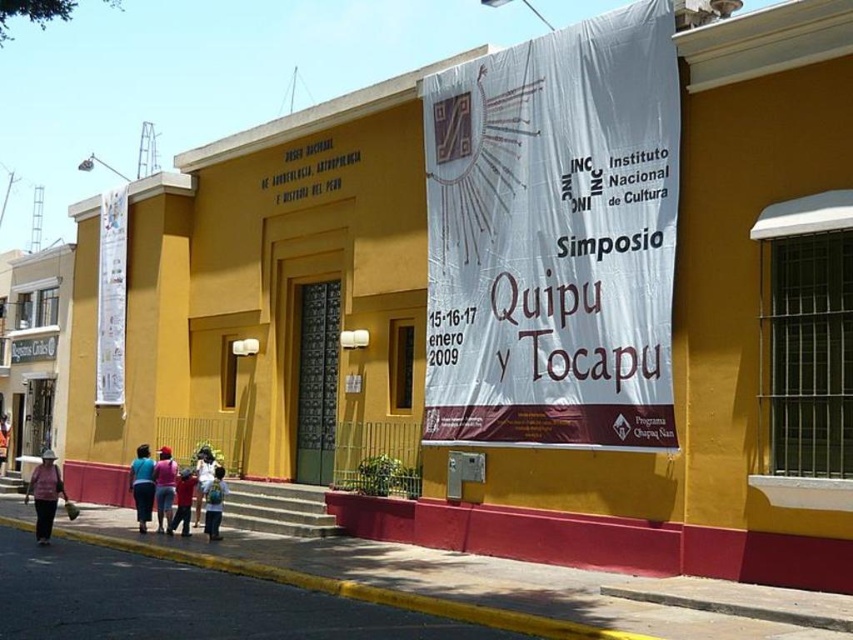
From the picture: Which is below, blue fabric shirt at lower left or blue denim jeans at lower center?

blue fabric shirt at lower left

Who is more distant from viewer, (x=144, y=492) or (x=206, y=518)?

Point (x=144, y=492)

This screenshot has width=853, height=640. I want to click on blue fabric shirt at lower left, so click(142, 484).

Can you confirm if white paper banner at upper center is positioned to the left of blue fabric shirt at lower left?

No, white paper banner at upper center is not to the left of blue fabric shirt at lower left.

Is white paper banner at upper center to the right of blue fabric shirt at lower left from the viewer's perspective?

Correct, you'll find white paper banner at upper center to the right of blue fabric shirt at lower left.

Is point (428, 324) in front of point (140, 449)?

That is True.

Where is `white paper banner at upper center`? The image size is (853, 640). white paper banner at upper center is located at coordinates (554, 237).

Is blue fabric shirt at lower left to the left of matte pink shirt at lower center from the viewer's perspective?

Yes, blue fabric shirt at lower left is to the left of matte pink shirt at lower center.

Can you confirm if blue fabric shirt at lower left is wider than matte pink shirt at lower center?

No, blue fabric shirt at lower left is not wider than matte pink shirt at lower center.

I want to click on blue fabric shirt at lower left, so click(142, 484).

Identify the location of blue fabric shirt at lower left. This screenshot has height=640, width=853. coord(142,484).